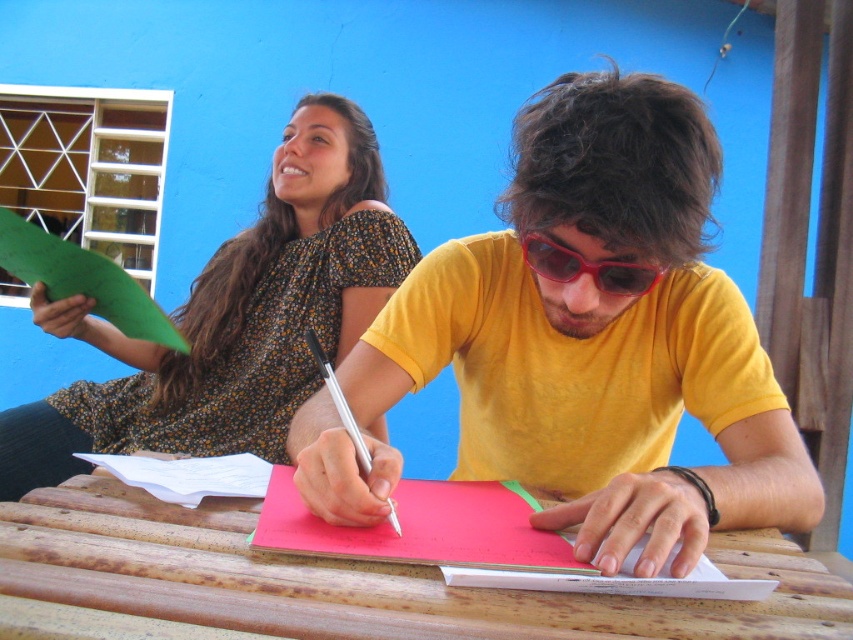
Question: Does yellow matte shirt at center appear under metallic silver pen at center?

Choices:
 (A) yes
 (B) no

Answer: (A)

Question: Which object appears farthest from the camera in this image?

Choices:
 (A) white paper at center
 (B) floral dress at upper left
 (C) red plastic sunglasses at center
 (D) yellow matte shirt at center

Answer: (B)

Question: Which point is farther to the camera?

Choices:
 (A) wooden at center
 (B) red plastic sunglasses at center

Answer: (B)

Question: Which of the following is the closest to the observer?

Choices:
 (A) (553, 280)
 (B) (357, 445)
 (C) (241, 611)

Answer: (C)

Question: In this image, where is wooden at center located relative to metallic silver pen at center?

Choices:
 (A) left
 (B) right

Answer: (B)

Question: Is white paper at center further to camera compared to red plastic sunglasses at center?

Choices:
 (A) yes
 (B) no

Answer: (B)